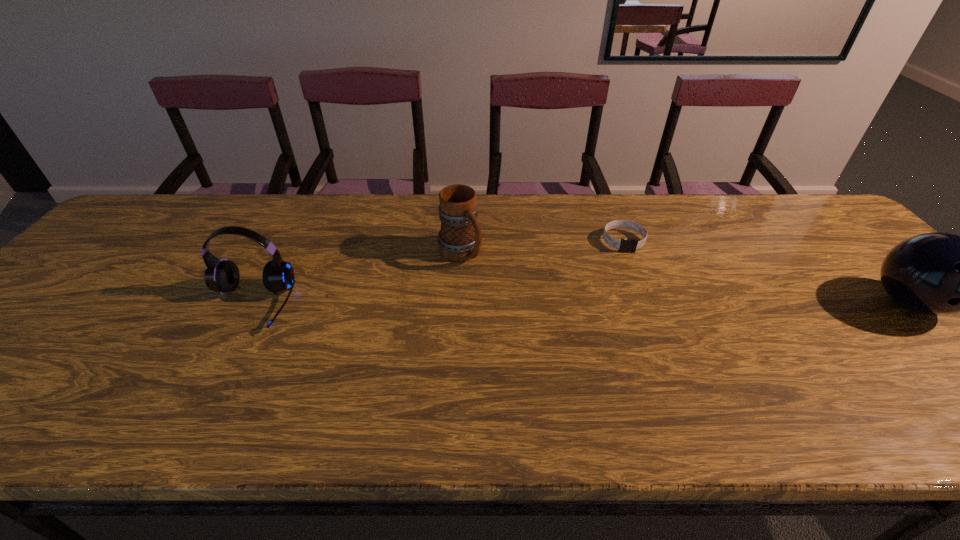
Where is `free space on the desktop that is between the headset and the bowling ball and is positioned on the side of the mug with the handle`? The width and height of the screenshot is (960, 540). free space on the desktop that is between the headset and the bowling ball and is positioned on the side of the mug with the handle is located at coordinates (511, 305).

Identify the location of vacant space on the desktop that is between the leftmost object and the rightmost object and is positioned on the outer surface of the shortest object. This screenshot has width=960, height=540. (645, 304).